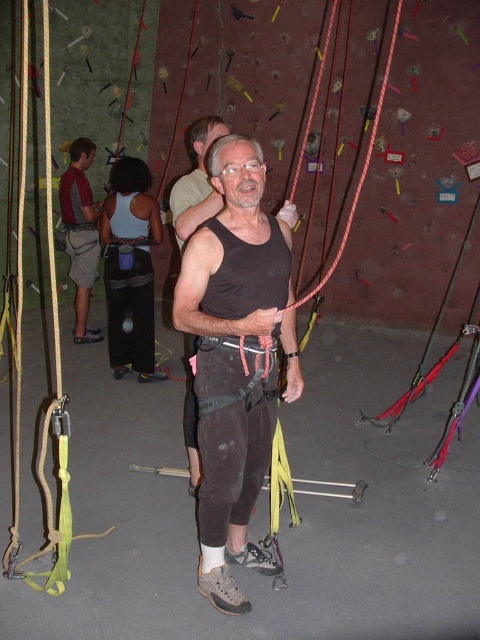
What is the exact coordinate of the black matte tank top at center?

The black matte tank top at center is located at point (236, 358).

You are a customer at the climbing facility and want to choose between the black matte tank top at center and the brushed metal tank top at left. Which one takes up more space on the rack?

The brushed metal tank top at left takes up more space than the black matte tank top at center because the black matte tank top at center occupies less space than the brushed metal tank top at left.

You are a safety inspector at the climbing facility. You need to ensure that the safety harness ropes are within a 2.5 meter distance from the viewer to comply with safety regulations. Is the point at coordinates point (212, 547) within the required distance?

The distance between point (212, 547) and the viewer is 2.28 meters, which is within the 2.5 meter safety regulation requirement. Therefore, the point is compliant.